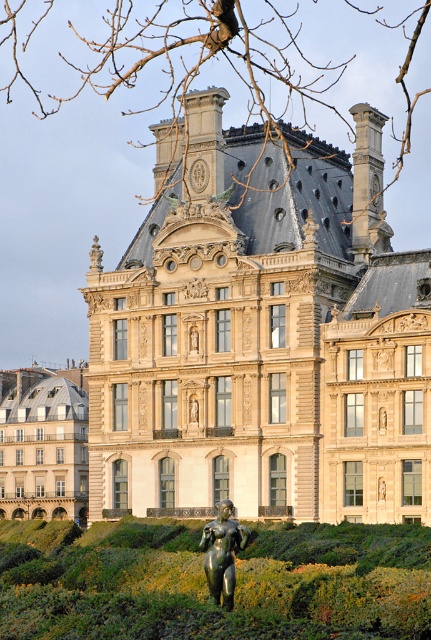
You are a tourist standing in front of the beige stone palace at center and the green grass at lower center. Which object is located to the left of the other?

The green grass at lower center is located to the left of the beige stone palace at center because the beige stone palace at center is positioned on the right side of green grass at lower center.